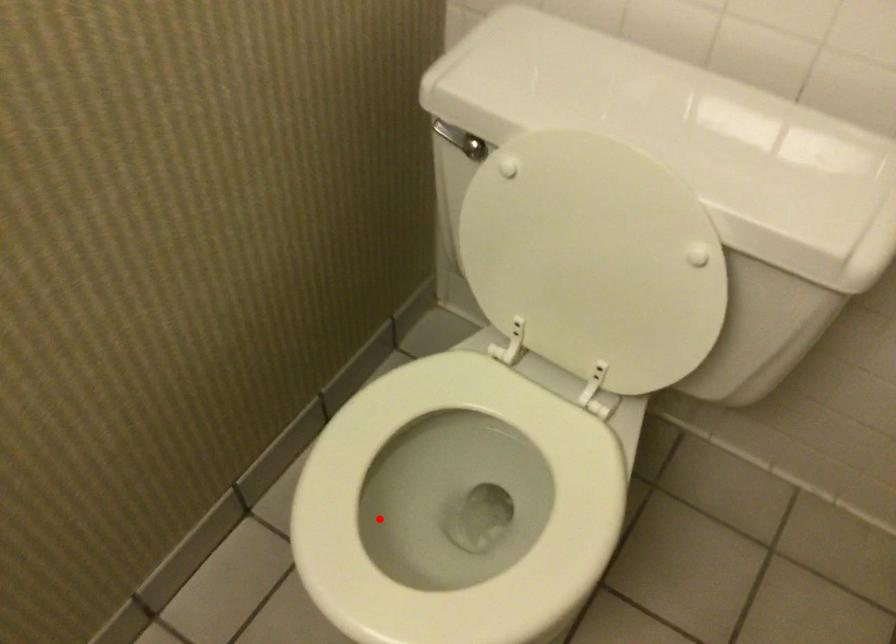
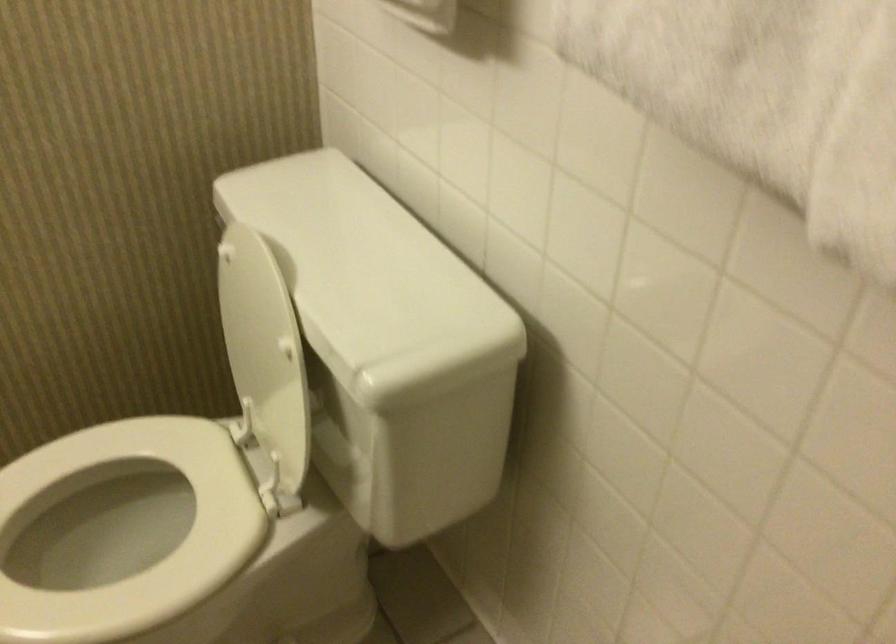
Question: I am providing you with two images of the same scene from different viewpoints. In image1, a red point is highlighted. Considering the same 3D point in image2, which of the following is correct?

Choices:
 (A) It is closer
 (B) It is farther

Answer: (B)